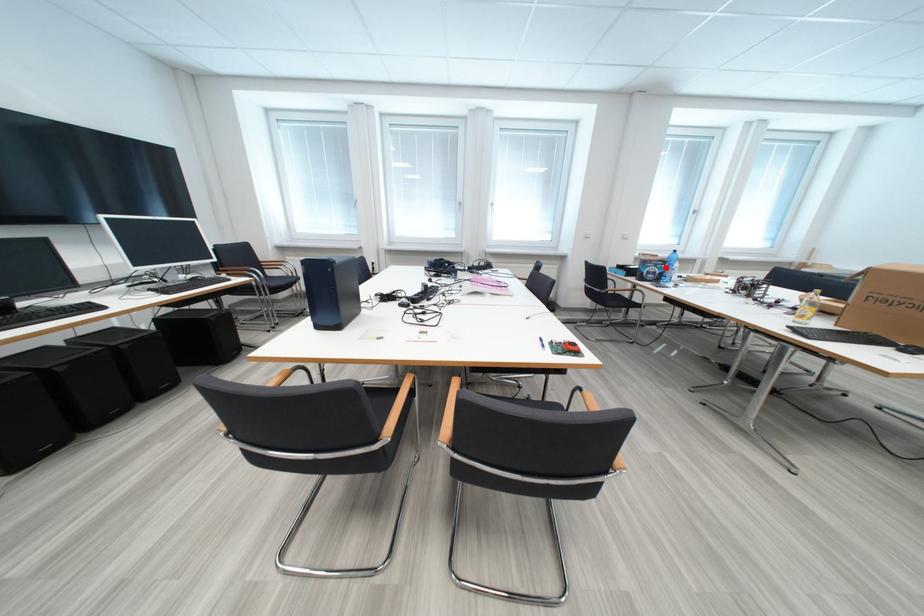
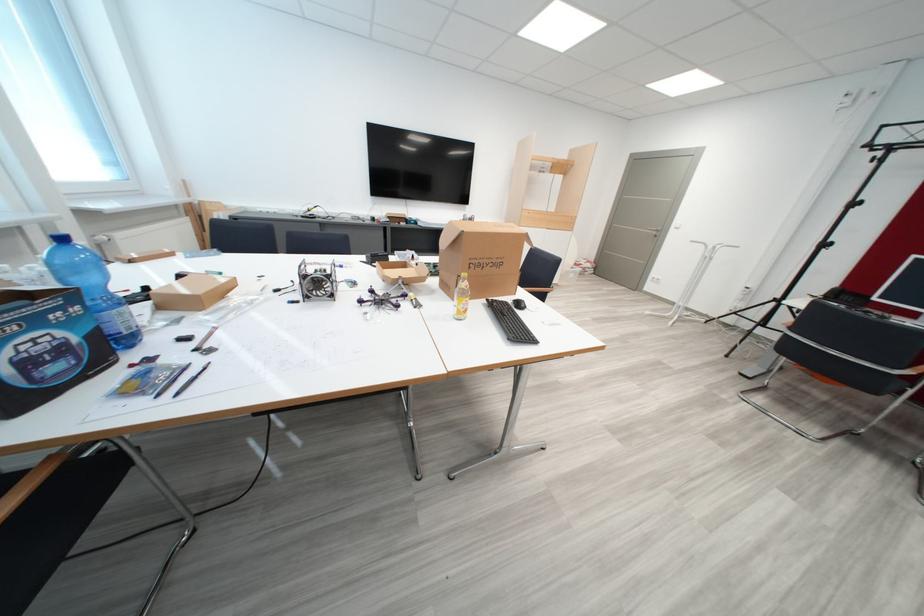
Question: I am providing you with two images of the same scene from different viewpoints. A red point is marked on the first image. Is the red point's position out of view in image 2?

Choices:
 (A) Yes
 (B) No

Answer: (B)